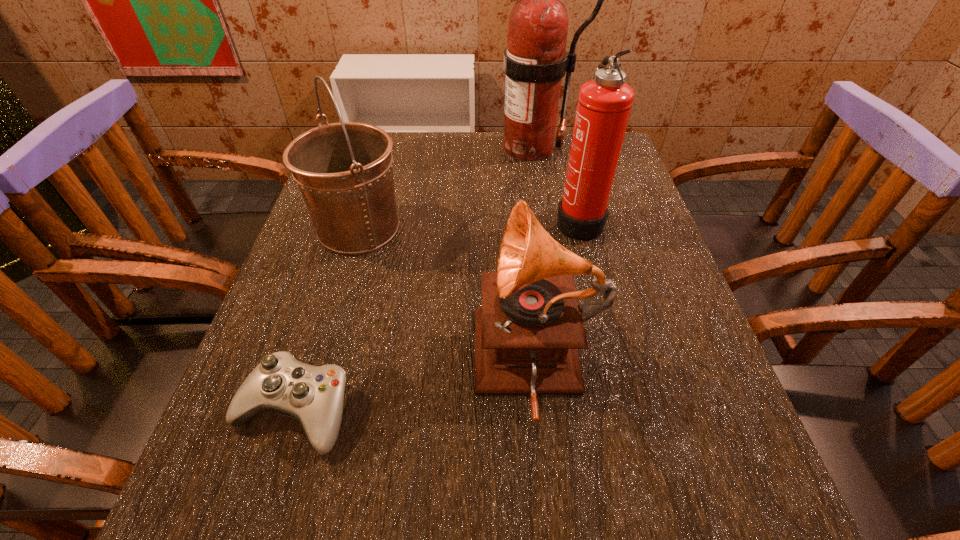
The height and width of the screenshot is (540, 960). Find the location of `the taller fire extinguisher`. the taller fire extinguisher is located at coordinates (535, 61).

At what (x,y) coordinates should I click in order to perform the action: click on the farthest object. Please return your answer as a coordinate pair (x, y). This screenshot has width=960, height=540. Looking at the image, I should click on (535, 61).

This screenshot has width=960, height=540. I want to click on the nearer fire extinguisher, so click(604, 104).

Identify the location of the shorter fire extinguisher. (604, 104).

I want to click on bucket, so click(344, 171).

Where is `phonograph record`? The image size is (960, 540). phonograph record is located at coordinates (528, 331).

At what (x,y) coordinates should I click in order to perform the action: click on the shortest object. Please return your answer as a coordinate pair (x, y). Looking at the image, I should click on (313, 395).

Find the location of a particular element. This screenshot has height=540, width=960. vacant space located 0.320m at the nozzle of the taller fire extinguisher is located at coordinates (369, 148).

Identify the location of free space located at the nozzle of the taller fire extinguisher. The image size is (960, 540). (447, 148).

Locate an element on the screen. free space located at the nozzle of the taller fire extinguisher is located at coordinates (348, 148).